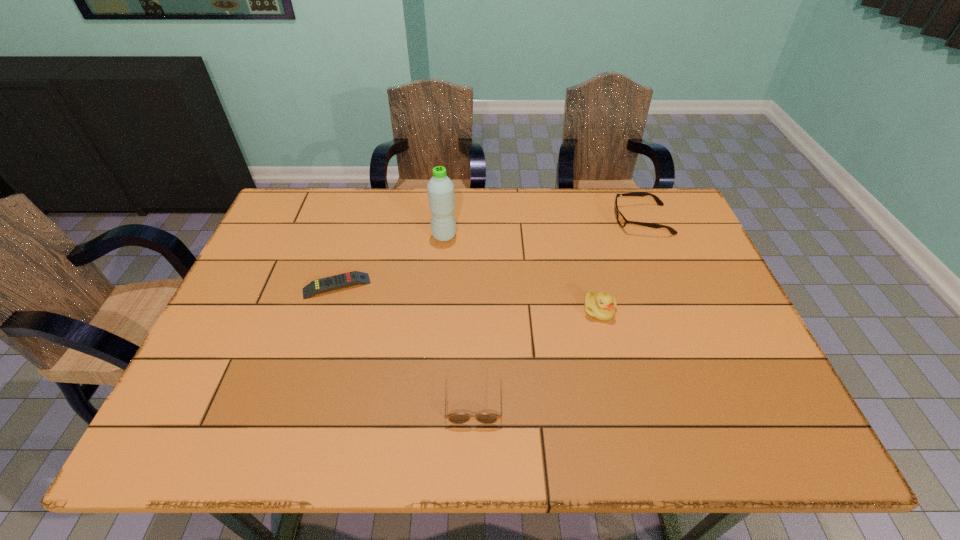
You are a GUI agent. You are given a task and a screenshot of the screen. Output one action in this format:
    pyautogui.click(x=<x>, y=<y>)
    Task: Click on the free space located 0.300m on the front-facing side of the rightmost object
    This screenshot has height=540, width=960.
    Given the screenshot: What is the action you would take?
    pyautogui.click(x=519, y=220)

Where is `free space located on the front-facing side of the rightmost object`? The height and width of the screenshot is (540, 960). free space located on the front-facing side of the rightmost object is located at coordinates (501, 220).

This screenshot has height=540, width=960. I want to click on vacant space situated on the front-facing side of the rightmost object, so click(x=579, y=220).

You are a GUI agent. You are given a task and a screenshot of the screen. Output one action in this format:
    pyautogui.click(x=<x>, y=<y>)
    Task: Click on the vacant space located 0.050m on the front-facing side of the second shortest object
    
    Given the screenshot: What is the action you would take?
    pyautogui.click(x=472, y=448)

At what (x,y) coordinates should I click in order to perform the action: click on vacant region located 0.090m on the left of the shortest object. Please return your answer as a coordinate pair (x, y). This screenshot has width=960, height=540. Looking at the image, I should click on (271, 286).

You are a GUI agent. You are given a task and a screenshot of the screen. Output one action in this format:
    pyautogui.click(x=<x>, y=<y>)
    Task: Click on the water bottle that is positioned at the far edge
    This screenshot has height=540, width=960.
    Given the screenshot: What is the action you would take?
    pyautogui.click(x=440, y=188)

At what (x,y) coordinates should I click in order to perform the action: click on spectacles that is at the far edge. Please return your answer as a coordinate pair (x, y). The height and width of the screenshot is (540, 960). Looking at the image, I should click on coord(622,221).

I want to click on object located in the near edge section of the desktop, so click(457, 418).

Locate an element on the screen. object present at the right edge is located at coordinates (622, 221).

What are the coordinates of `object that is at the far right corner` in the screenshot? It's located at (622, 221).